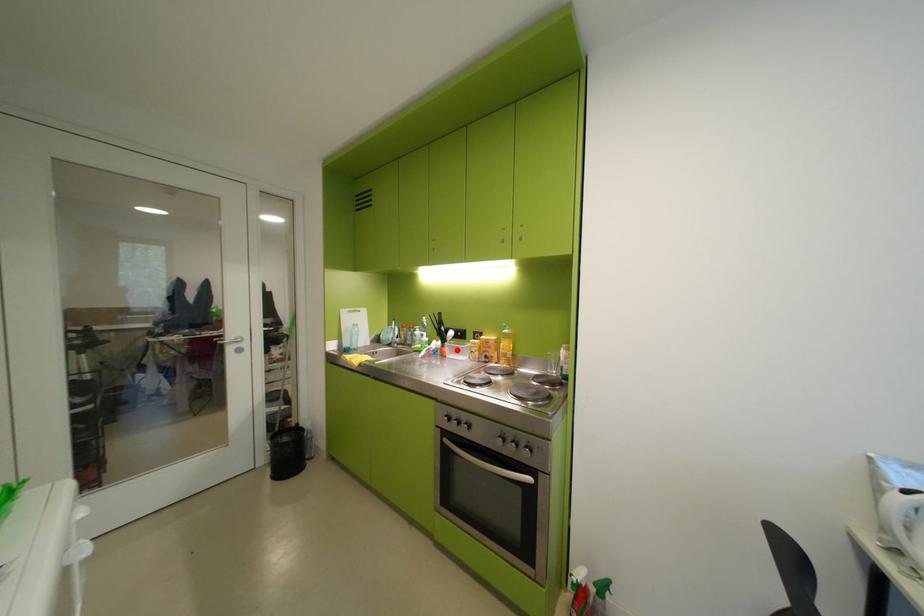
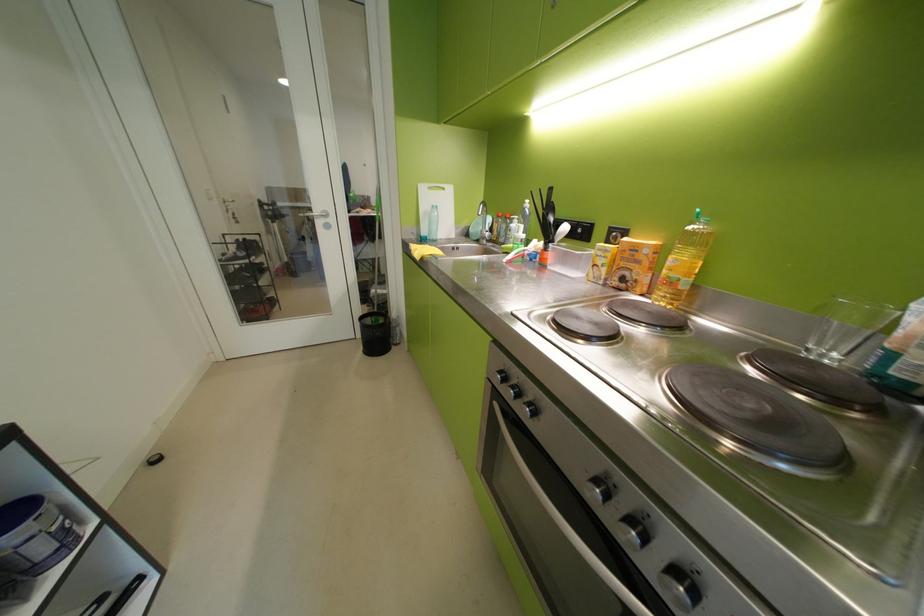
In the second image, find the point that corresponds to the highlighted location in the first image.

(561, 256)